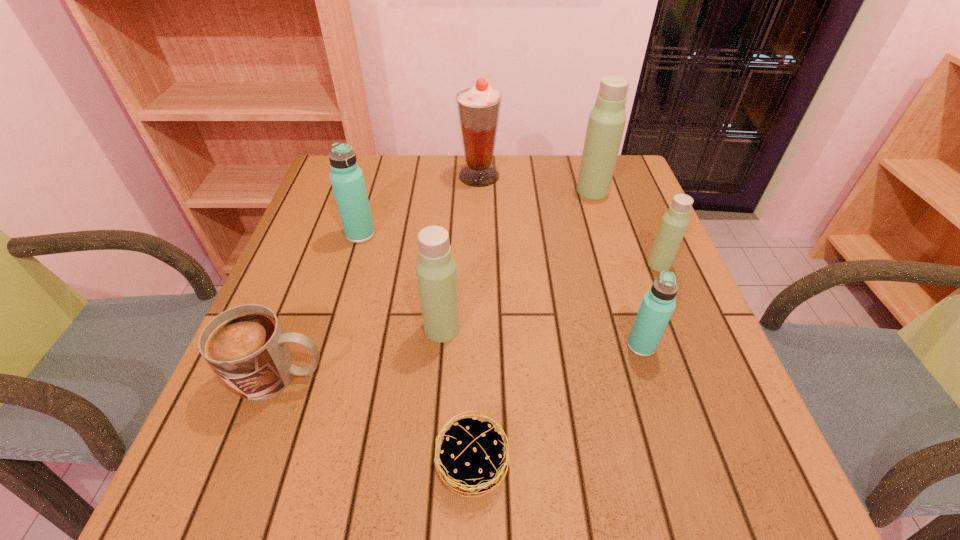
The width and height of the screenshot is (960, 540). Identify the location of the farthest thermos bottle. (607, 119).

At what (x,y) coordinates should I click in order to perform the action: click on the tallest thermos bottle. Please return your answer as a coordinate pair (x, y). The image size is (960, 540). Looking at the image, I should click on (607, 119).

Find the location of a particular element. smoothie is located at coordinates (479, 107).

Locate an element on the screen. This screenshot has width=960, height=540. the bigger aqua thermos bottle is located at coordinates (347, 180).

Where is `the left aqua thermos bottle`? The height and width of the screenshot is (540, 960). the left aqua thermos bottle is located at coordinates (347, 180).

I want to click on the leftmost light thermos bottle, so click(436, 270).

I want to click on the nearest light thermos bottle, so click(x=436, y=270).

You are a GUI agent. You are given a task and a screenshot of the screen. Output one action in this format:
    pyautogui.click(x=<x>, y=<y>)
    Task: Click on the right aqua thermos bottle
    The width and height of the screenshot is (960, 540).
    Given the screenshot: What is the action you would take?
    pyautogui.click(x=658, y=304)

Locate an element on the screen. the nearer aqua thermos bottle is located at coordinates (658, 304).

Where is `the fourth farthest object`? This screenshot has width=960, height=540. the fourth farthest object is located at coordinates (674, 223).